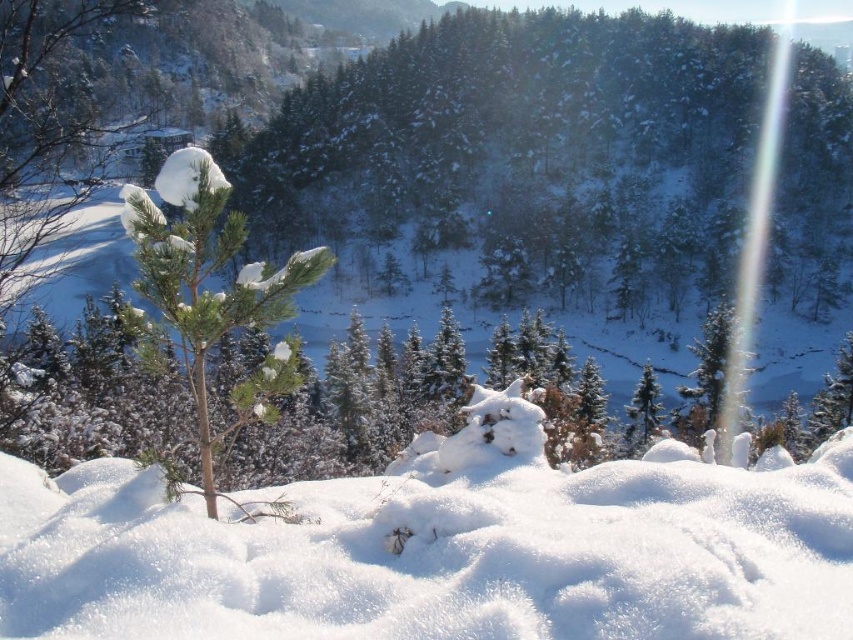
Is green matte pine tree at left smaller than green matte tree at center-right?

No, green matte pine tree at left is not smaller than green matte tree at center-right.

Is green matte pine tree at left taller than green matte tree at center-right?

Indeed, green matte pine tree at left has a greater height compared to green matte tree at center-right.

Who is more forward, [206,320] or [648,365]?

Point [206,320]

This screenshot has width=853, height=640. In order to click on green matte pine tree at left in this screenshot , I will do `click(210, 292)`.

Does green matte pine tree at left have a greater width compared to green matte tree at upper right?

Indeed, green matte pine tree at left has a greater width compared to green matte tree at upper right.

Is point (215, 195) positioned after point (708, 355)?

No.

At what (x,y) coordinates should I click in order to perform the action: click on green matte pine tree at left. Please return your answer as a coordinate pair (x, y). The image size is (853, 640). Looking at the image, I should click on (210, 292).

From the picture: Who is positioned more to the left, white fluffy snow at center or green matte tree at upper right?

From the viewer's perspective, white fluffy snow at center appears more on the left side.

Who is more distant from viewer, (621, 496) or (682, 390)?

The point (682, 390) is behind.

Which is in front, point (316, 488) or point (695, 352)?

Positioned in front is point (316, 488).

Find the location of a particular element. The image size is (853, 640). white fluffy snow at center is located at coordinates (439, 548).